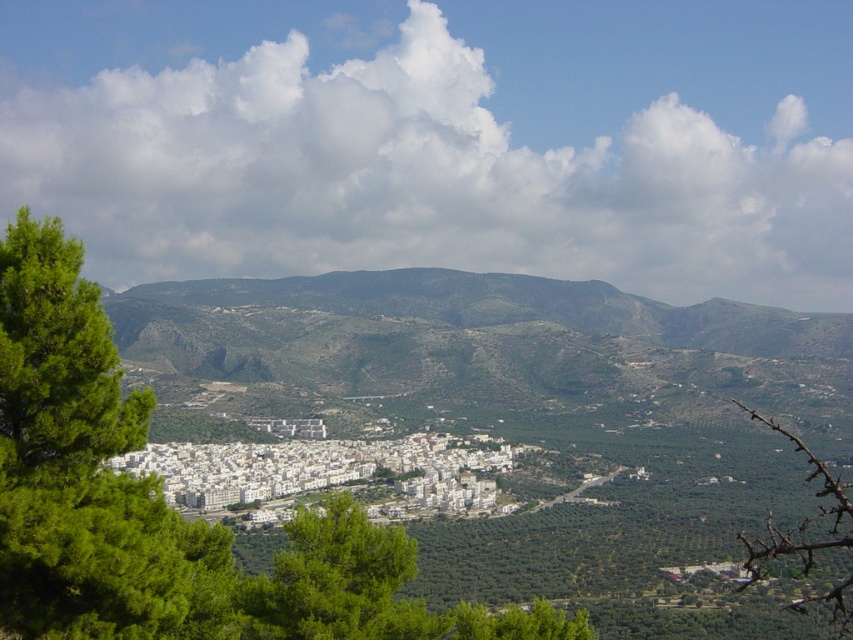
You are standing in the valley and want to take a photo of both point (x=511, y=627) and point (x=828, y=522). Since you want both points to be clearly visible in the photo, which point should you focus on to ensure sharpness?

You should focus on point (x=511, y=627) because it is closer to the camera than point (x=828, y=522). Focusing on the closer point will keep it sharp, and the farther point may still be in acceptable focus depending on the lens and aperture used.